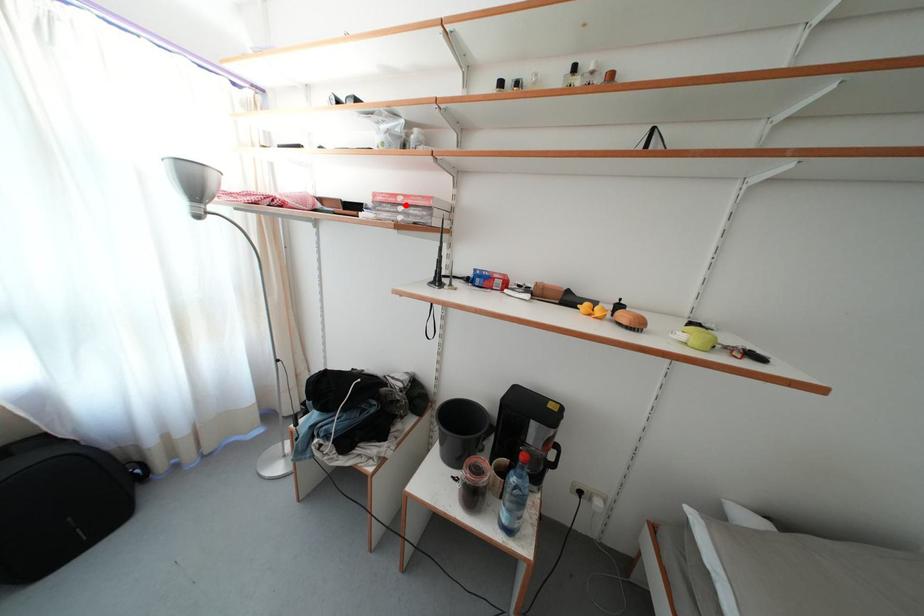
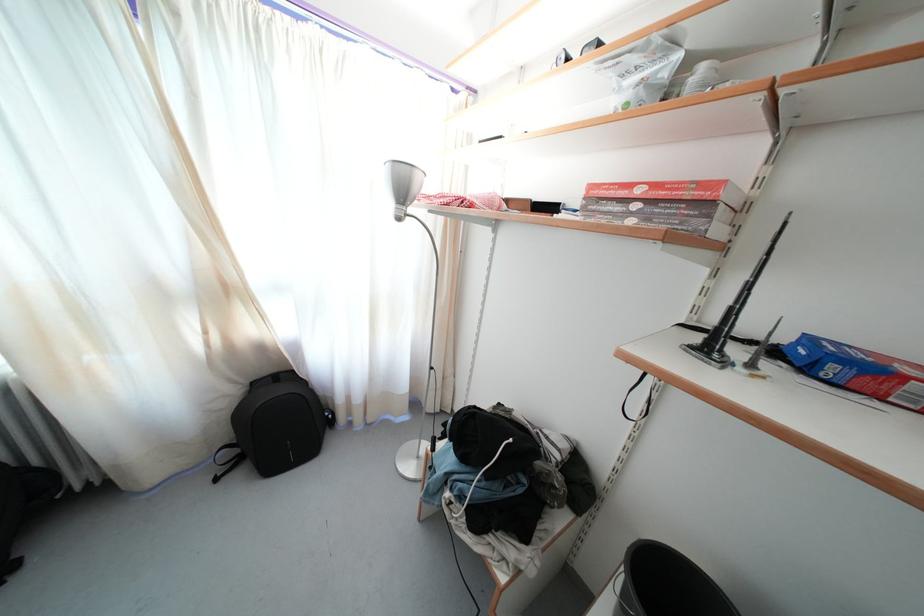
Locate, in the second image, the point that corresponds to the highlighted location in the first image.

(645, 197)